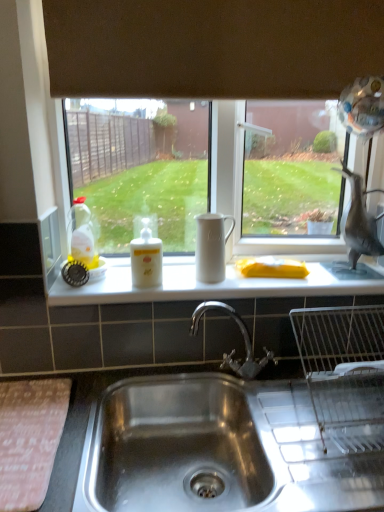
Where is `vacant space situated on the left part of gray matte bird at right`? The height and width of the screenshot is (512, 384). vacant space situated on the left part of gray matte bird at right is located at coordinates (304, 266).